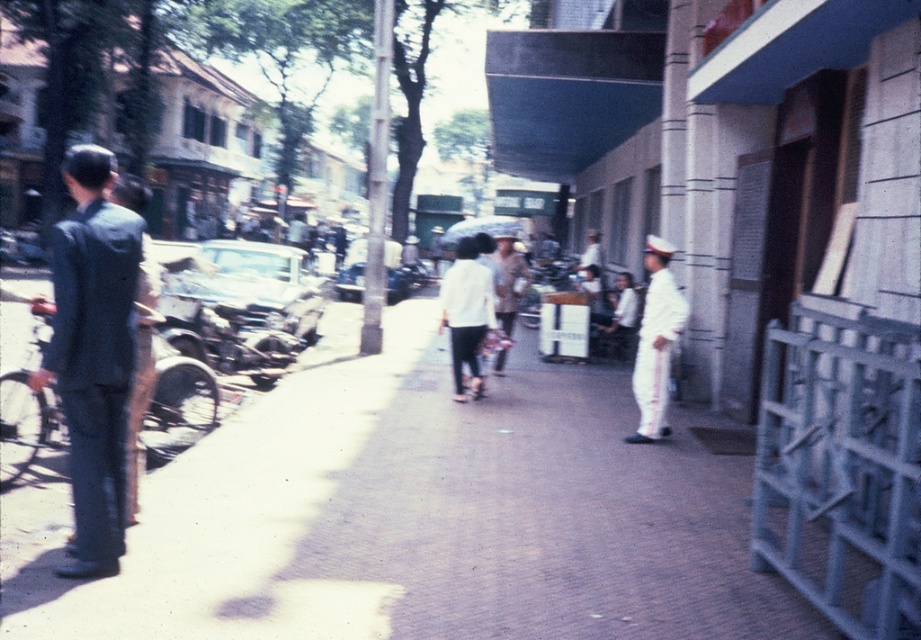
Question: Which point is farther to the camera?

Choices:
 (A) (299, 474)
 (B) (502, 246)
 (C) (671, 337)

Answer: (B)

Question: Among these points, which one is farthest from the camera?

Choices:
 (A) (463, 342)
 (B) (663, 364)
 (C) (467, 625)
 (D) (511, 305)

Answer: (D)

Question: Which point is closer to the camera?

Choices:
 (A) smooth concrete pavement at center
 (B) dark blue suit at left

Answer: (A)

Question: Is smooth concrete pavement at center positioned in front of light brown fabric shirt at center?

Choices:
 (A) no
 (B) yes

Answer: (B)

Question: In this image, where is smooth concrete pavement at center located relative to transparent plastic umbrella at center?

Choices:
 (A) left
 (B) right

Answer: (A)

Question: Is white uniform at right in front of white uniform at center?

Choices:
 (A) no
 (B) yes

Answer: (B)